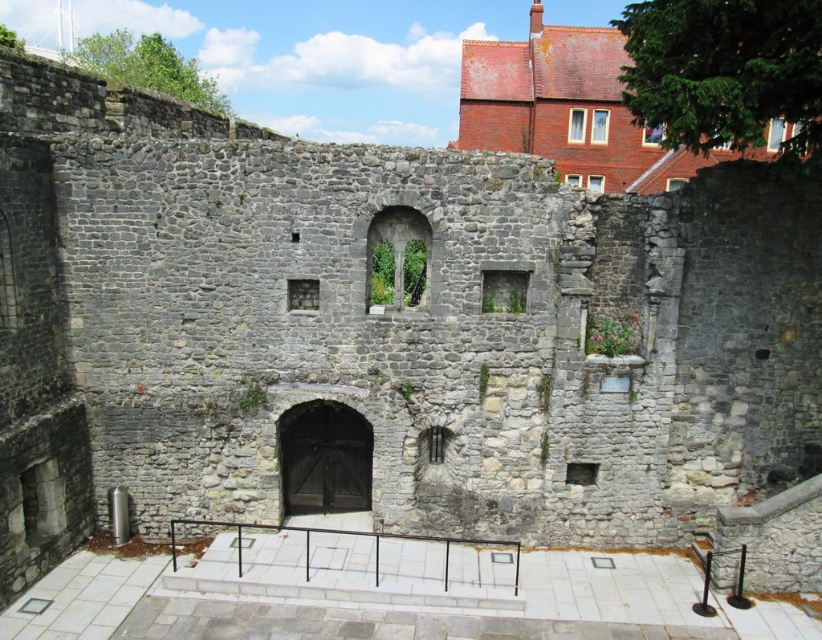
You are standing at the point with coordinates (324, 458) in the image. What object are you directly facing?

The point at coordinates (324, 458) corresponds to the dark wood door at center, so you are directly facing the dark wood door at center.

You are an architect inspecting the historical stone structure. You notice the dark wood door at center and the black metal rail at center. Which object is located to the left of the other?

The dark wood door at center is positioned on the left side of the black metal rail at center, so the dark wood door at center is to the left of the black metal rail at center.

Looking at this image, you are a painter who needs to decide which object to paint first between the dark wood door at center and the black metal rail at center. Since you want to paint the wider object first, which one should you choose?

The black metal rail at center is wider than the dark wood door at center, so you should paint the black metal rail at center first.